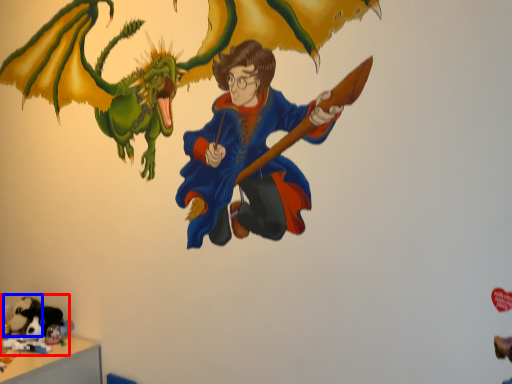
Question: Which object appears closest to the camera in this image, toy (highlighted by a red box) or animal (highlighted by a blue box)?

Choices:
 (A) toy
 (B) animal

Answer: (A)